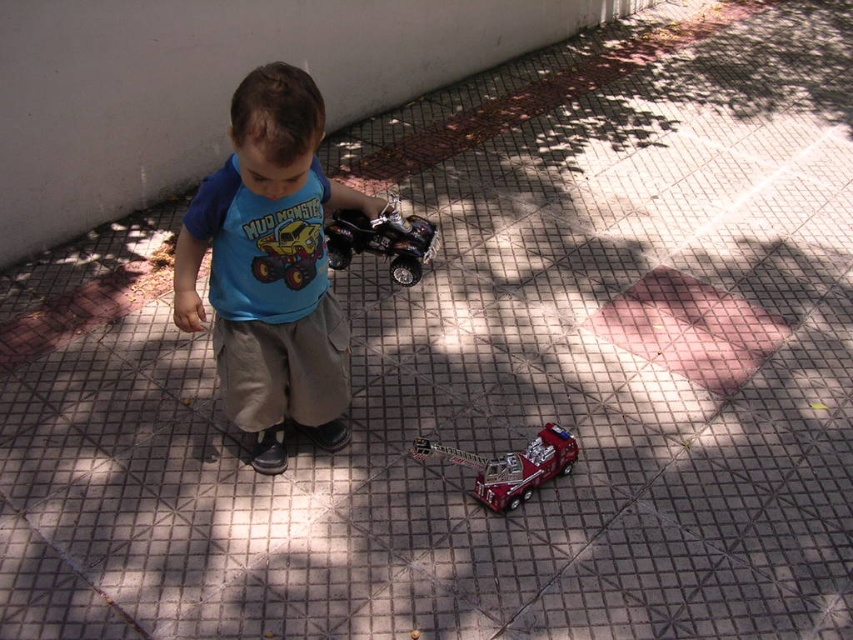
Question: Is shiny metallic quad bike at center closer to camera compared to shiny yellow plastic truck at center?

Choices:
 (A) yes
 (B) no

Answer: (B)

Question: Which point is farther from the camera taking this photo?

Choices:
 (A) (532, 445)
 (B) (289, 236)
 (C) (412, 212)
 (D) (312, 209)

Answer: (C)

Question: Which point is closer to the camera?

Choices:
 (A) (512, 476)
 (B) (274, 125)
 (C) (318, 237)
 (D) (326, 224)

Answer: (B)

Question: From the image, what is the correct spatial relationship of shiny metallic quad bike at center in relation to shiny yellow plastic truck at center?

Choices:
 (A) above
 (B) below

Answer: (A)

Question: Does blue cotton shirt at center appear over shiny red firetruck at center?

Choices:
 (A) no
 (B) yes

Answer: (B)

Question: Which point appears closest to the camera in this image?

Choices:
 (A) (328, 221)
 (B) (289, 260)

Answer: (B)